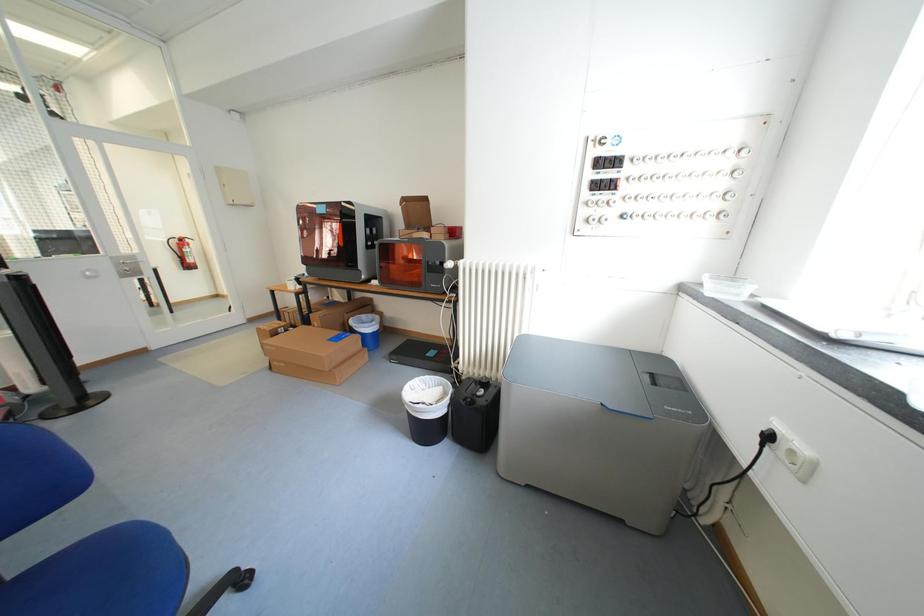
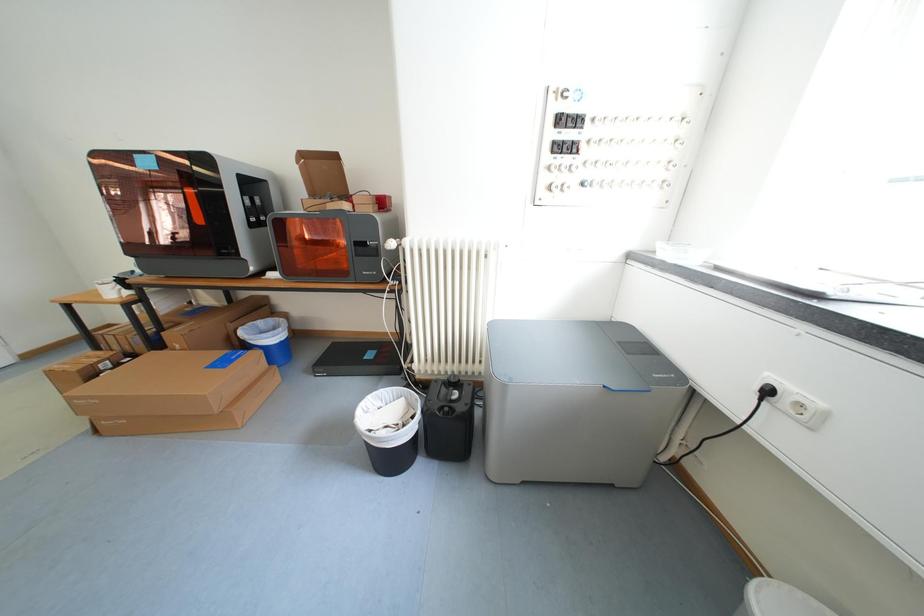
Question: How did the camera likely rotate?

Choices:
 (A) Left
 (B) Right
 (C) Up
 (D) Down

Answer: (B)